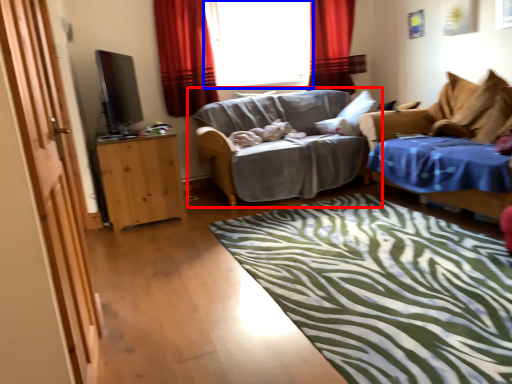
Question: Among these objects, which one is nearest to the camera, studio couch (highlighted by a red box) or window (highlighted by a blue box)?

Choices:
 (A) studio couch
 (B) window

Answer: (A)